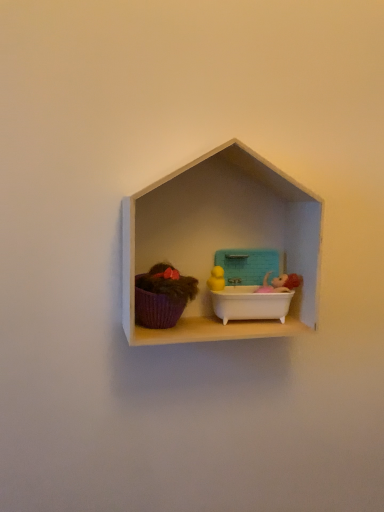
The image size is (384, 512). Describe the element at coordinates (162, 296) in the screenshot. I see `purple fabric basket at left` at that location.

The width and height of the screenshot is (384, 512). What do you see at coordinates (252, 286) in the screenshot?
I see `teal plastic lunch box at center` at bounding box center [252, 286].

Locate an element on the screen. The width and height of the screenshot is (384, 512). purple fabric basket at left is located at coordinates (162, 296).

Consider the image. From the image's perspective, would you say purple fabric basket at left is shown under white matte shelf at center?

Yes.

From the picture: From a real-world perspective, is purple fabric basket at left on white matte shelf at center?

Incorrect, from a real-world perspective, purple fabric basket at left is lower than white matte shelf at center.

Is purple fabric basket at left turned away from white matte shelf at center?

Absolutely, purple fabric basket at left is directed away from white matte shelf at center.

Is there a large distance between purple fabric basket at left and white matte shelf at center?

That's not correct — purple fabric basket at left is a little close to white matte shelf at center.

Is white matte shelf at center not inside purple fabric basket at left?

Yes.

Is white matte shelf at center smaller than purple fabric basket at left?

Incorrect, white matte shelf at center is not smaller in size than purple fabric basket at left.

How distant is white matte shelf at center from purple fabric basket at left?

The distance of white matte shelf at center from purple fabric basket at left is 4.03 inches.

From the picture: Is white matte shelf at center turned away from purple fabric basket at left?

Yes.

Is purple fabric basket at left further to the viewer compared to teal plastic lunch box at center?

No, purple fabric basket at left is closer to the viewer.

From the image's perspective, is purple fabric basket at left located above or below teal plastic lunch box at center?

purple fabric basket at left is above teal plastic lunch box at center.

Would you consider purple fabric basket at left to be distant from teal plastic lunch box at center?

No, purple fabric basket at left is in close proximity to teal plastic lunch box at center.

Is teal plastic lunch box at center surrounded by purple fabric basket at left?

No.

From a real-world perspective, between teal plastic lunch box at center and white matte shelf at center, who is vertically lower?

In real-world perspective, teal plastic lunch box at center is lower.

Can you confirm if teal plastic lunch box at center is thinner than white matte shelf at center?

Indeed, teal plastic lunch box at center has a lesser width compared to white matte shelf at center.

Is point (222, 263) positioned before point (184, 226)?

No, (222, 263) is further to viewer.

Is teal plastic lunch box at center inside or outside of white matte shelf at center?

teal plastic lunch box at center is enclosed within white matte shelf at center.

How much distance is there between teal plastic lunch box at center and purple fabric basket at left?

The distance of teal plastic lunch box at center from purple fabric basket at left is 4.17 inches.

In terms of height, does teal plastic lunch box at center look taller or shorter compared to purple fabric basket at left?

In the image, teal plastic lunch box at center appears to be shorter than purple fabric basket at left.

From the image's perspective, which one is positioned higher, teal plastic lunch box at center or purple fabric basket at left?

purple fabric basket at left is shown above in the image.

Which is nearer, (239, 265) or (165, 322)?

The point (165, 322) is closer to the camera.

Which is less distant, (272, 329) or (258, 296)?

Point (272, 329)

From the image's perspective, between white matte shelf at center and teal plastic lunch box at center, who is located below?

From the image's view, teal plastic lunch box at center is below.

From a real-world perspective, between white matte shelf at center and teal plastic lunch box at center, who is vertically higher?

white matte shelf at center, from a real-world perspective.

Between white matte shelf at center and teal plastic lunch box at center, which one appears on the right side from the viewer's perspective?

Positioned to the right is teal plastic lunch box at center.

At what (x,y) coordinates should I click in order to perform the action: click on toy located below the white matte shelf at center (from the image's perspective). Please return your answer as a coordinate pair (x, y). Looking at the image, I should click on pos(162,296).

This screenshot has width=384, height=512. I want to click on toy beneath the white matte shelf at center (from a real-world perspective), so click(162, 296).

When comparing their distances from purple fabric basket at left, does white matte shelf at center or teal plastic lunch box at center seem further?

teal plastic lunch box at center is positioned further to the anchor purple fabric basket at left.

From the image, which object appears to be nearer to purple fabric basket at left, teal plastic lunch box at center or white matte shelf at center?

white matte shelf at center is positioned closer to the anchor purple fabric basket at left.

Estimate the real-world distances between objects in this image. Which object is closer to white matte shelf at center, teal plastic lunch box at center or purple fabric basket at left?

The object closer to white matte shelf at center is teal plastic lunch box at center.

Estimate the real-world distances between objects in this image. Which object is closer to white matte shelf at center, purple fabric basket at left or teal plastic lunch box at center?

teal plastic lunch box at center is positioned closer to the anchor white matte shelf at center.

Considering their positions, is purple fabric basket at left positioned closer to teal plastic lunch box at center than white matte shelf at center?

white matte shelf at center is positioned closer to the anchor teal plastic lunch box at center.

Consider the image. When comparing their distances from teal plastic lunch box at center, does white matte shelf at center or purple fabric basket at left seem closer?

Based on the image, white matte shelf at center appears to be nearer to teal plastic lunch box at center.

I want to click on shelf located between purple fabric basket at left and teal plastic lunch box at center in the left-right direction, so click(221, 239).